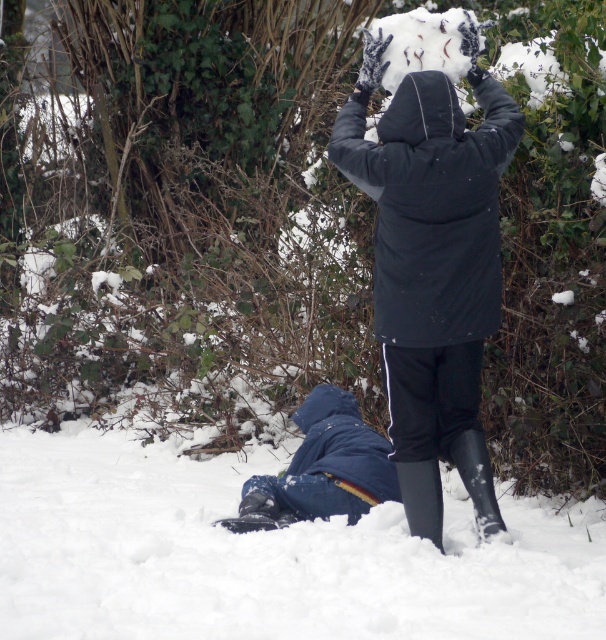
Question: Among these points, which one is nearest to the camera?

Choices:
 (A) (401, 480)
 (B) (454, 193)
 (C) (487, 497)

Answer: (B)

Question: Which point is farther from the camera taking this photo?

Choices:
 (A) (467, 476)
 (B) (474, 451)

Answer: (A)

Question: Is matte black coat at center bigger than rubber boots at lower center?

Choices:
 (A) yes
 (B) no

Answer: (A)

Question: Which object appears closest to the camera in this image?

Choices:
 (A) rubber boots at lower center
 (B) matte black coat at center
 (C) black rubber boot at lower center

Answer: (B)

Question: Does rubber boots at lower center have a smaller size compared to black rubber boot at lower center?

Choices:
 (A) no
 (B) yes

Answer: (A)

Question: Is matte black coat at center above rubber boots at lower center?

Choices:
 (A) no
 (B) yes

Answer: (B)